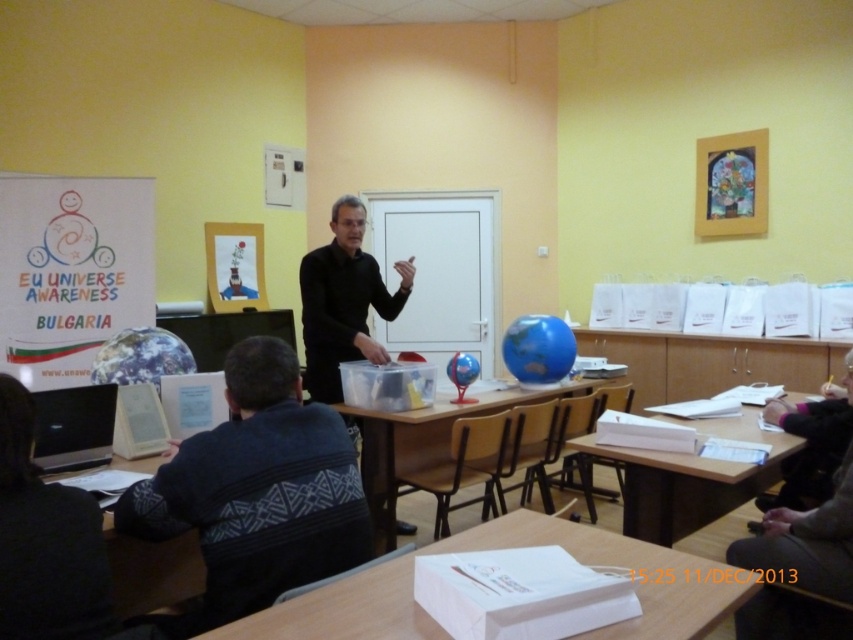
You are a student sitting at the wooden table at lower left and you want to reach for the white paper at lower center. Can you easily reach it from your current position?

The white paper at lower center is in front of the wooden table at lower left, so it is positioned closer to you. You can easily reach it from your current position.

You are a student in the classroom and need to place your notebook on the wooden table at lower right and the wooden table at lower left. Which table is higher up in the image?

The wooden table at lower right is positioned over the wooden table at lower left, meaning it is higher up in the image.